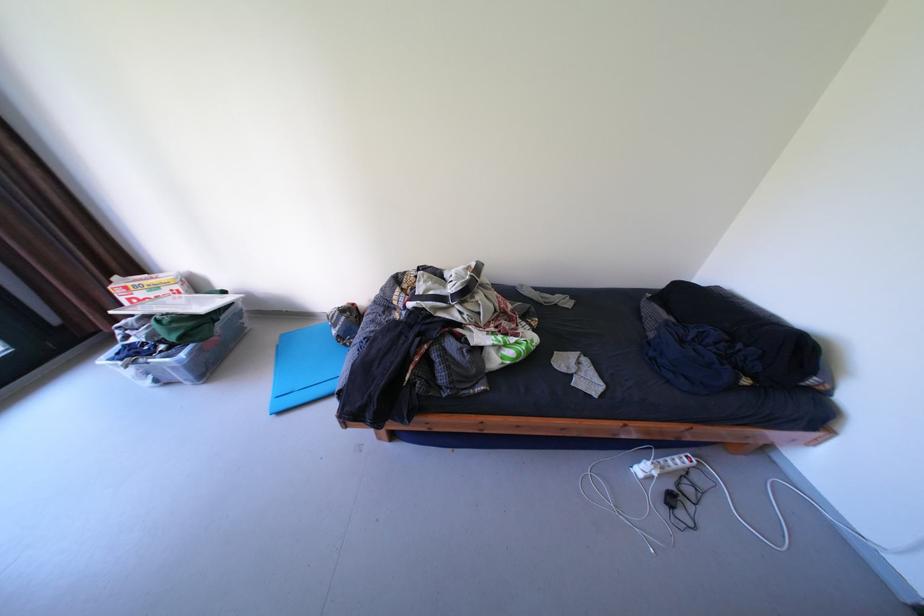
Identify the location of blue folded mat. Image resolution: width=924 pixels, height=616 pixels. (305, 367).